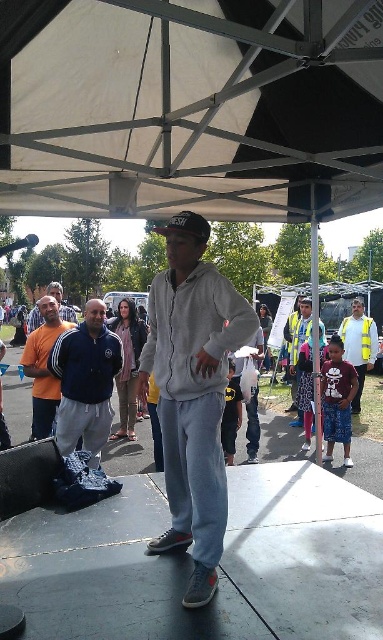
Question: Among these objects, which one is nearest to the camera?

Choices:
 (A) blue fleece jacket at center
 (B) matte black hoodie at center

Answer: (A)

Question: Is light gray fleece hoodie at center to the right of orange cotton t-shirt at left from the viewer's perspective?

Choices:
 (A) no
 (B) yes

Answer: (B)

Question: Does blue fleece jacket at center appear on the left side of reflective yellow vest at center?

Choices:
 (A) yes
 (B) no

Answer: (A)

Question: Which object appears closest to the camera in this image?

Choices:
 (A) blue fleece jacket at center
 (B) reflective yellow vest at right

Answer: (A)

Question: Which point appears closest to the camera in this image?

Choices:
 (A) (191, 356)
 (B) (91, 310)
 (C) (356, 300)

Answer: (A)

Question: Does blue fleece jacket at center appear on the left side of reflective yellow vest at center?

Choices:
 (A) yes
 (B) no

Answer: (A)